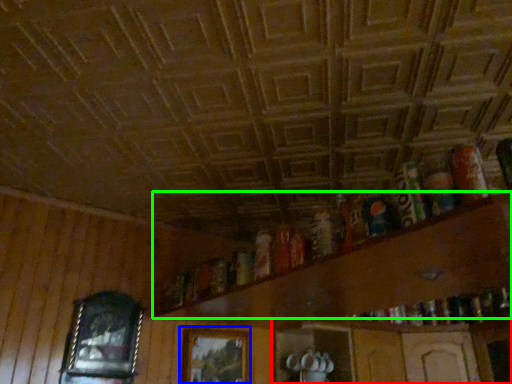
Question: Estimate the real-world distances between objects in this image. Which object is farther from shelf (highlighted by a red box), picture frame (highlighted by a blue box) or shelf (highlighted by a green box)?

Choices:
 (A) picture frame
 (B) shelf

Answer: (B)